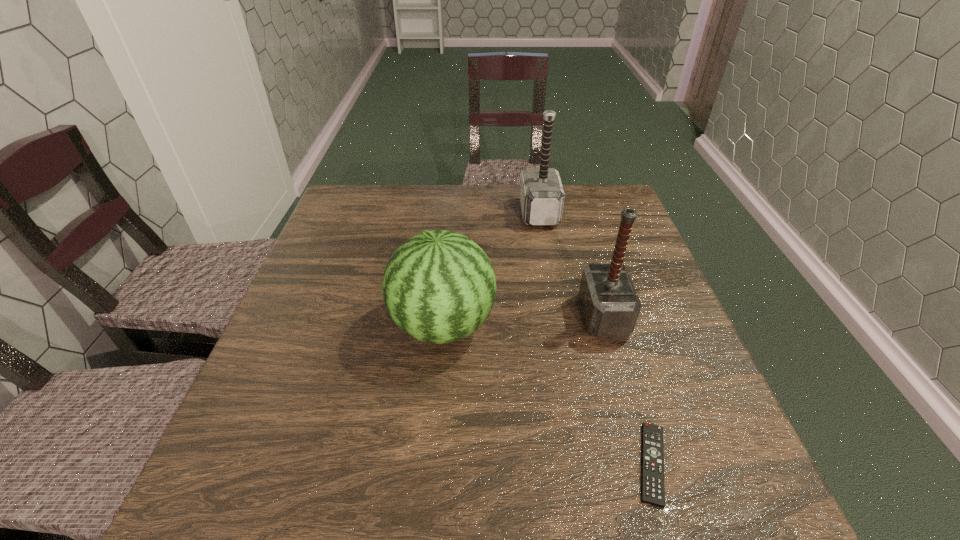
Find the location of a particular element. The height and width of the screenshot is (540, 960). vacant space located 0.290m on the back of the remote control is located at coordinates (606, 309).

This screenshot has width=960, height=540. Find the location of `object located at the far edge`. object located at the far edge is located at coordinates (542, 196).

I want to click on object that is at the near edge, so click(x=652, y=488).

Identify the location of hammer positioned at the right edge. This screenshot has height=540, width=960. (610, 304).

Image resolution: width=960 pixels, height=540 pixels. In order to click on remote control positioned at the right edge in this screenshot , I will do `click(652, 488)`.

Identify the location of object positioned at the near right corner. The height and width of the screenshot is (540, 960). (652, 488).

This screenshot has width=960, height=540. In order to click on free space at the far edge of the desktop in this screenshot , I will do `click(483, 186)`.

Locate an element on the screen. free location at the near edge is located at coordinates (359, 474).

This screenshot has width=960, height=540. What are the coordinates of `vacant area at the left edge of the desktop` in the screenshot? It's located at (314, 269).

Image resolution: width=960 pixels, height=540 pixels. In the image, there is a desktop. What are the coordinates of `vacant region at the right edge` in the screenshot? It's located at (606, 231).